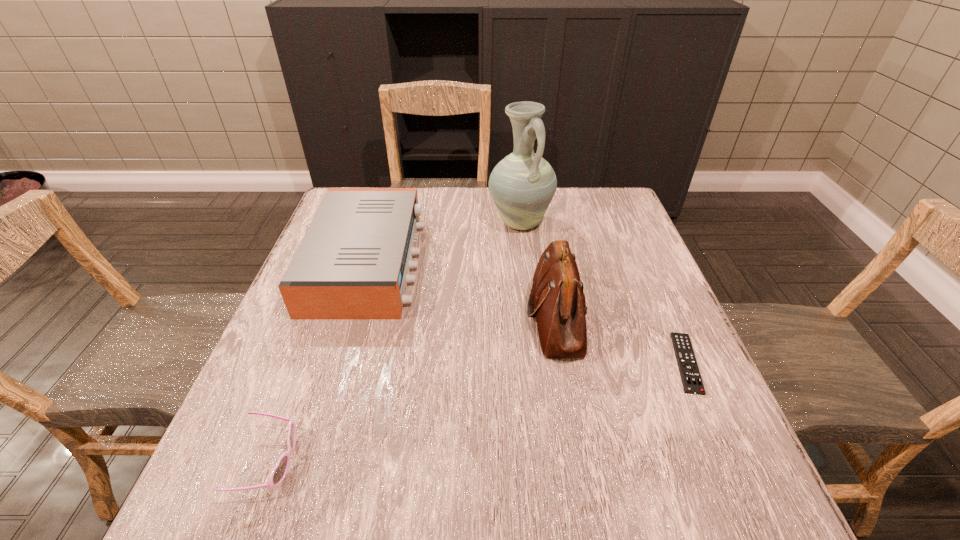
Identify the location of the tallest object. (522, 185).

At what (x,y) coordinates should I click in order to perform the action: click on the fourth shortest object. Please return your answer as a coordinate pair (x, y). This screenshot has height=540, width=960. Looking at the image, I should click on (557, 300).

Locate an element on the screen. The width and height of the screenshot is (960, 540). the third tallest object is located at coordinates (353, 263).

Find the location of a particular element. The width and height of the screenshot is (960, 540). the nearest object is located at coordinates (279, 472).

Find the location of a particular element. sunglasses is located at coordinates (279, 472).

Identify the location of remote control. (690, 375).

Find the location of `the rightmost object`. the rightmost object is located at coordinates (690, 375).

Locate an element on the screen. vacant space located on the handle side of the pitcher is located at coordinates (531, 310).

You are a GUI agent. You are given a task and a screenshot of the screen. Output one action in this format:
    pyautogui.click(x=<x>, y=<y>)
    Task: Click on the vacant space situated 0.070m on the left of the shoulder bag
    Image resolution: width=960 pixels, height=540 pixels.
    Given the screenshot: What is the action you would take?
    pyautogui.click(x=495, y=317)

Identify the location of vacant space situated on the control panel of the radio receiver. This screenshot has height=540, width=960. (440, 262).